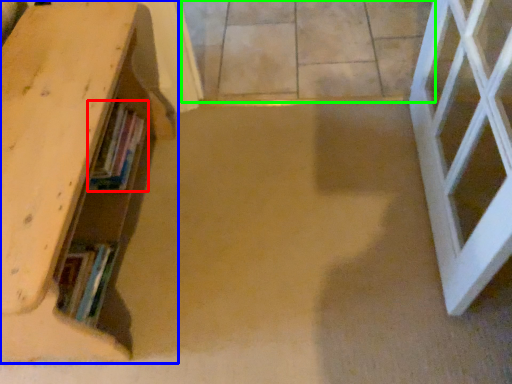
Question: Which object is the closest to the book (highlighted by a red box)? Choose among these: shelf (highlighted by a blue box) or concrete (highlighted by a green box).

Choices:
 (A) shelf
 (B) concrete

Answer: (A)